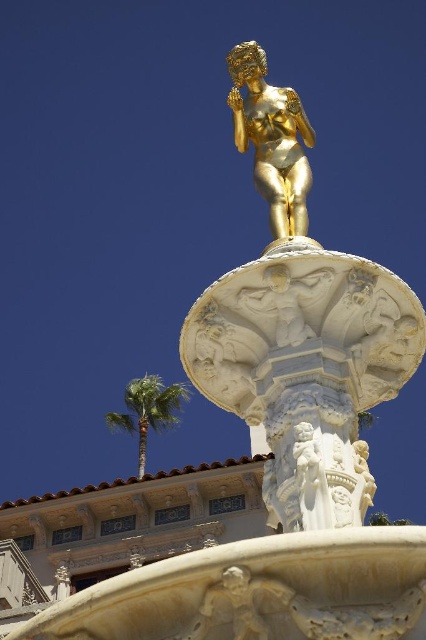
Does gold metallic statue at center have a greater height compared to green leafy palm tree at lower left?

Correct, gold metallic statue at center is much taller as green leafy palm tree at lower left.

Is gold metallic statue at center to the left of green leafy palm tree at lower left from the viewer's perspective?

No, gold metallic statue at center is not to the left of green leafy palm tree at lower left.

Where is `gold metallic statue at center`? The width and height of the screenshot is (426, 640). gold metallic statue at center is located at coordinates (271, 138).

Locate an element on the screen. Image resolution: width=426 pixels, height=640 pixels. gold metallic statue at center is located at coordinates (271, 138).

Which of these two, gold polished statue at center or gold metallic statue at center, stands shorter?

With less height is gold polished statue at center.

This screenshot has width=426, height=640. What do you see at coordinates (299, 326) in the screenshot?
I see `gold polished statue at center` at bounding box center [299, 326].

What do you see at coordinates (299, 326) in the screenshot? I see `gold polished statue at center` at bounding box center [299, 326].

I want to click on gold polished statue at center, so click(x=299, y=326).

Who is shorter, gold polished statue at center or green leafy palm tree at lower left?

green leafy palm tree at lower left

At what (x,y) coordinates should I click in order to perform the action: click on gold polished statue at center. Please return your answer as a coordinate pair (x, y). Image resolution: width=426 pixels, height=640 pixels. Looking at the image, I should click on (299, 326).

Identify the location of gold polished statue at center. (299, 326).